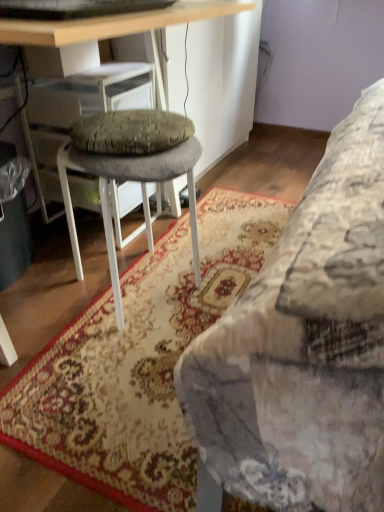
Question: From a real-world perspective, is floral carpet at lower right over wooden desk at center?

Choices:
 (A) no
 (B) yes

Answer: (A)

Question: Are floral carpet at lower right and wooden desk at center making contact?

Choices:
 (A) yes
 (B) no

Answer: (B)

Question: From the image's perspective, does floral carpet at lower right appear higher than wooden desk at center?

Choices:
 (A) no
 (B) yes

Answer: (A)

Question: Is floral carpet at lower right thinner than wooden desk at center?

Choices:
 (A) no
 (B) yes

Answer: (B)

Question: Is floral carpet at lower right facing away from wooden desk at center?

Choices:
 (A) no
 (B) yes

Answer: (B)

Question: In terms of size, does wooden desk at center appear bigger or smaller than gray fabric stool at center?

Choices:
 (A) small
 (B) big

Answer: (B)

Question: Considering the positions of wooden desk at center and gray fabric stool at center in the image, is wooden desk at center wider or thinner than gray fabric stool at center?

Choices:
 (A) wide
 (B) thin

Answer: (A)

Question: Considering the positions of wooden desk at center and gray fabric stool at center in the image, is wooden desk at center taller or shorter than gray fabric stool at center?

Choices:
 (A) short
 (B) tall

Answer: (B)

Question: In the image, is wooden desk at center positioned in front of or behind gray fabric stool at center?

Choices:
 (A) behind
 (B) front

Answer: (B)

Question: From the image's perspective, relative to wooden desk at center, is floral carpet at lower right above or below?

Choices:
 (A) below
 (B) above

Answer: (A)

Question: Is floral carpet at lower right wider or thinner than wooden desk at center?

Choices:
 (A) thin
 (B) wide

Answer: (A)

Question: Relative to wooden desk at center, is floral carpet at lower right in front or behind?

Choices:
 (A) front
 (B) behind

Answer: (B)

Question: Is floral carpet at lower right to the left or to the right of wooden desk at center in the image?

Choices:
 (A) right
 (B) left

Answer: (A)

Question: From a real-world perspective, relative to gray fabric stool at center, is floral carpet at lower right vertically above or below?

Choices:
 (A) above
 (B) below

Answer: (B)

Question: Looking at their shapes, would you say floral carpet at lower right is wider or thinner than gray fabric stool at center?

Choices:
 (A) wide
 (B) thin

Answer: (A)